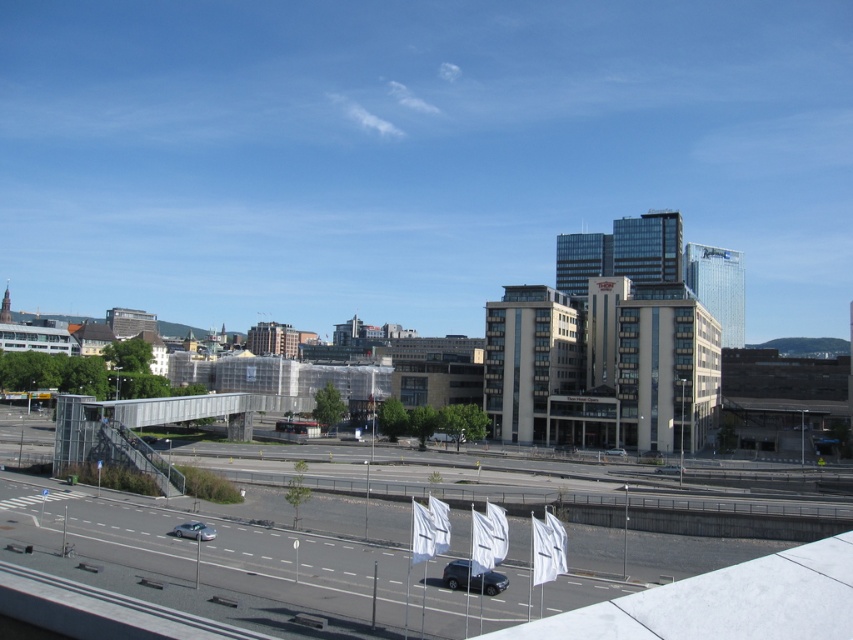
Does white fabric flags at lower center have a smaller size compared to matte black suv at center?

No, white fabric flags at lower center is not smaller than matte black suv at center.

Is white fabric flags at lower center to the right of matte black suv at center from the viewer's perspective?

Incorrect, white fabric flags at lower center is not on the right side of matte black suv at center.

Which is in front, point (120, 506) or point (471, 582)?

Point (471, 582) is in front.

This screenshot has width=853, height=640. Identify the location of white fabric flags at lower center. (207, 563).

Who is positioned more to the left, metallic gray overpass at center or satin silver car at lower left?

Positioned to the left is metallic gray overpass at center.

Does metallic gray overpass at center lie behind satin silver car at lower left?

Yes, metallic gray overpass at center is behind satin silver car at lower left.

Which is in front, point (84, 420) or point (187, 532)?

Point (187, 532) is more forward.

Identify the location of metallic gray overpass at center. Image resolution: width=853 pixels, height=640 pixels. (151, 426).

Between matte black suv at center and satin silver car at lower left, which one is positioned higher?

satin silver car at lower left

Which of these two, matte black suv at center or satin silver car at lower left, stands taller?

matte black suv at center is taller.

Locate an element on the screen. matte black suv at center is located at coordinates (473, 579).